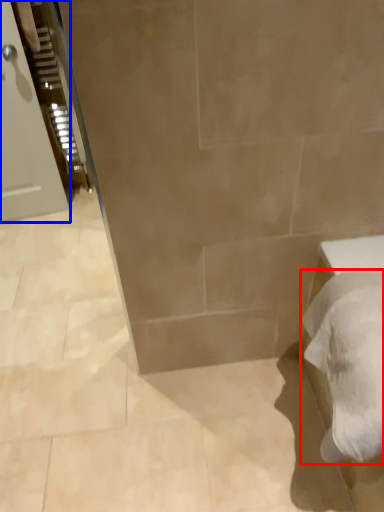
Question: Among these objects, which one is farthest to the camera, bath towel (highlighted by a red box) or door (highlighted by a blue box)?

Choices:
 (A) bath towel
 (B) door

Answer: (B)